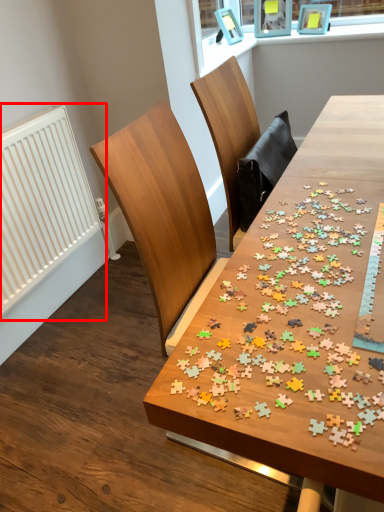
Question: Considering the relative positions of radiator (annotated by the red box) and table in the image provided, where is radiator (annotated by the red box) located with respect to the staircase?

Choices:
 (A) right
 (B) left

Answer: (B)